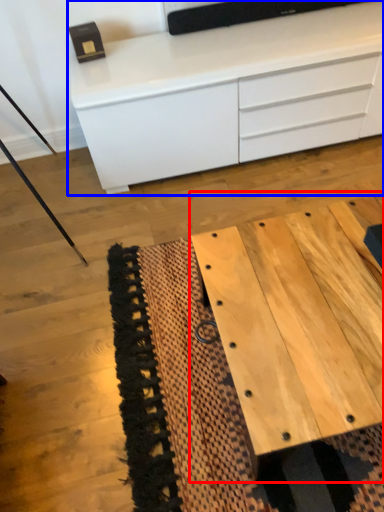
Question: Which point is further to the camera, table (highlighted by a red box) or chest of drawers (highlighted by a blue box)?

Choices:
 (A) table
 (B) chest of drawers

Answer: (B)